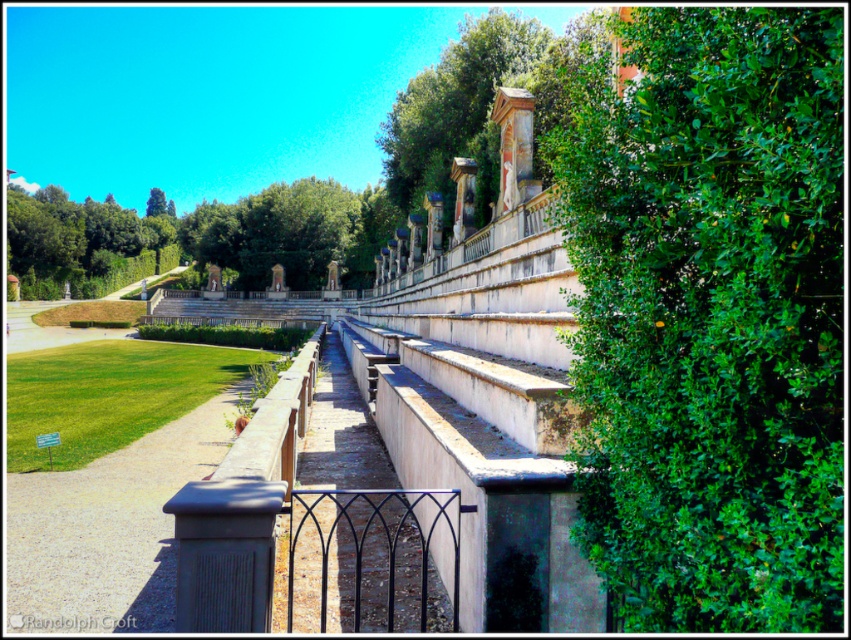
Question: Does green leafy tree at upper center have a larger size compared to green leafy tree at upper left?

Choices:
 (A) yes
 (B) no

Answer: (B)

Question: Which of the following is the farthest from the observer?

Choices:
 (A) gray concrete path at lower left
 (B) black wrought iron fence at center

Answer: (A)

Question: Is gray concrete path at lower left positioned before green leafy tree at upper left?

Choices:
 (A) no
 (B) yes

Answer: (B)

Question: Is green leafy bush at right further to camera compared to gray concrete path at lower left?

Choices:
 (A) no
 (B) yes

Answer: (A)

Question: Which point is closer to the camera?

Choices:
 (A) (373, 497)
 (B) (495, 81)

Answer: (A)

Question: Which point appears farthest from the camera in this image?

Choices:
 (A) (461, 72)
 (B) (343, 515)
 (C) (21, 540)
 (D) (75, 212)

Answer: (D)